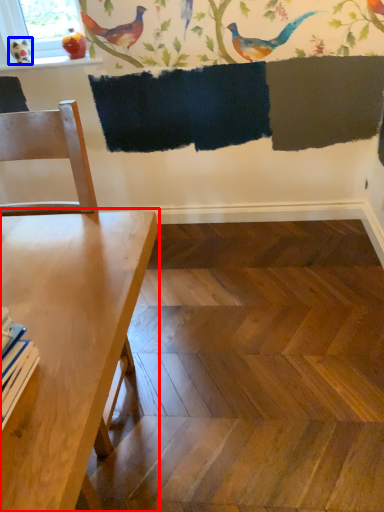
Question: Which object is further to the camera taking this photo, table (highlighted by a red box) or bird (highlighted by a blue box)?

Choices:
 (A) table
 (B) bird

Answer: (B)